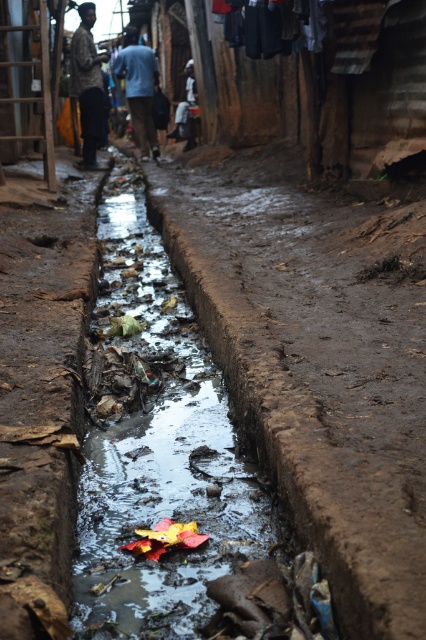
Does patterned fabric shirt at upper left appear under dark blue fabric at center?

Correct, patterned fabric shirt at upper left is located below dark blue fabric at center.

Can you confirm if patterned fabric shirt at upper left is thinner than dark blue fabric at center?

Yes.

Consider the image. Who is more distant from viewer, (95,80) or (186,125)?

The point (186,125) is behind.

This screenshot has width=426, height=640. Identify the location of patterned fabric shirt at upper left. (88, 83).

Is blue cotton shirt at upper center smaller than dark blue fabric at center?

No.

Who is more forward, (129, 67) or (175, 129)?

Positioned in front is point (129, 67).

Between point (135, 28) and point (187, 136), which one is positioned in front?

Point (135, 28) is in front.

Locate an element on the screen. Image resolution: width=426 pixels, height=640 pixels. blue cotton shirt at upper center is located at coordinates (138, 88).

Between dark blue fabric at upper center and patterned fabric shirt at upper left, which one is positioned lower?

dark blue fabric at upper center is below.

You are a GUI agent. You are given a task and a screenshot of the screen. Output one action in this format:
    pyautogui.click(x=<x>, y=<y>)
    Task: Click on the dark blue fabric at upper center
    This screenshot has width=426, height=640.
    Given the screenshot: What is the action you would take?
    pyautogui.click(x=271, y=26)